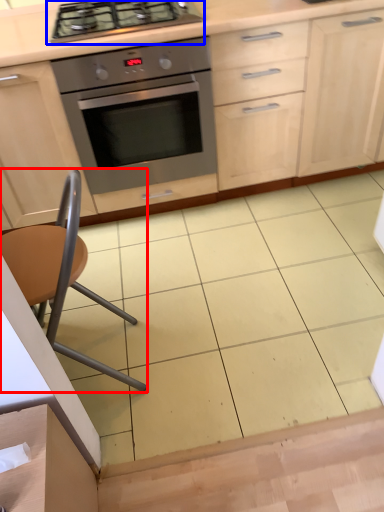
Question: Which of the following is the farthest to the observer, chair (highlighted by a red box) or gas stove (highlighted by a blue box)?

Choices:
 (A) chair
 (B) gas stove

Answer: (B)